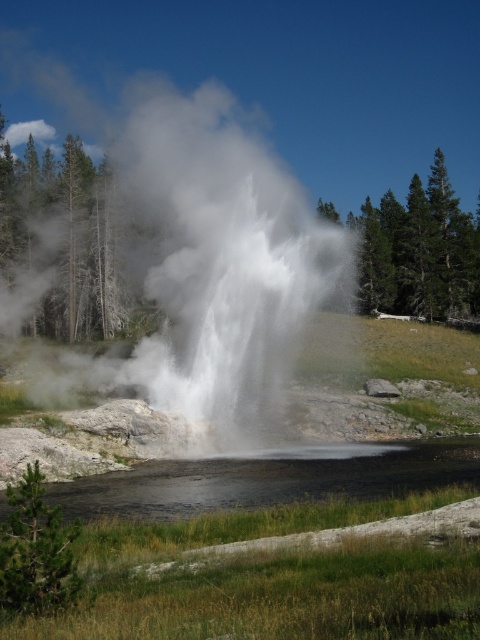
Question: Which object is farther from the camera taking this photo?

Choices:
 (A) white vapor at center
 (B) black reflective water at lower center

Answer: (A)

Question: Can you confirm if white vapor at center is positioned to the right of black reflective water at lower center?

Choices:
 (A) yes
 (B) no

Answer: (B)

Question: Does white vapor at center have a larger size compared to black reflective water at lower center?

Choices:
 (A) yes
 (B) no

Answer: (A)

Question: Which object is farther from the camera taking this photo?

Choices:
 (A) black reflective water at lower center
 (B) white vapor at center

Answer: (B)

Question: Can you confirm if white vapor at center is positioned above black reflective water at lower center?

Choices:
 (A) yes
 (B) no

Answer: (A)